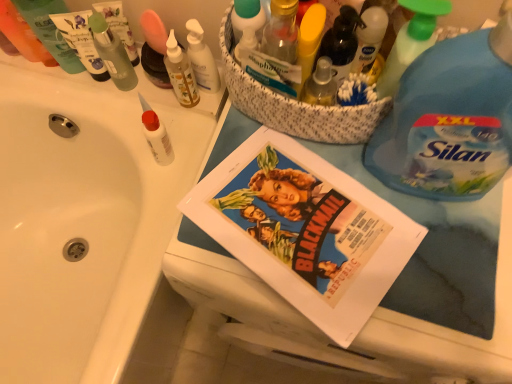
Image resolution: width=512 pixels, height=384 pixels. I want to click on free space to the back side of white matte glue at upper left, the fifth toiletry from the left, so [167, 118].